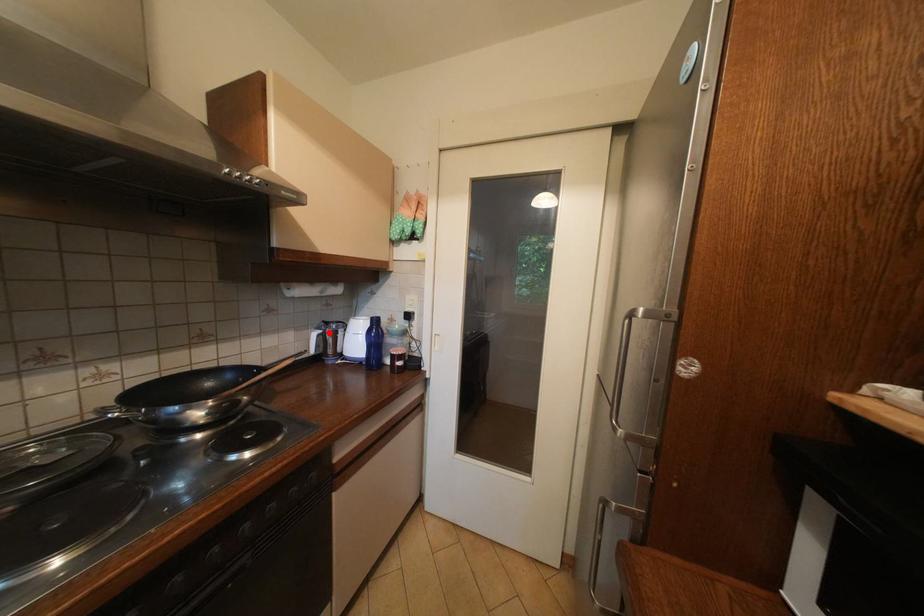
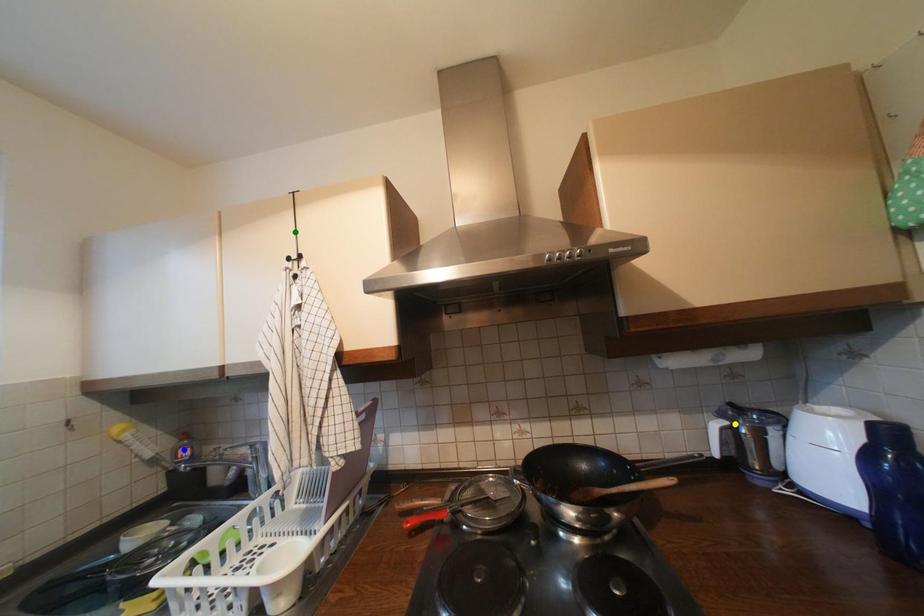
Question: I am providing you with two images of the same scene from different viewpoints. A red point is marked on the first image. You are given multiple points on the second image. Which point in image 2 represents the same 3d spot as the red point in image 1?

Choices:
 (A) blue point
 (B) green point
 (C) yellow point

Answer: (C)